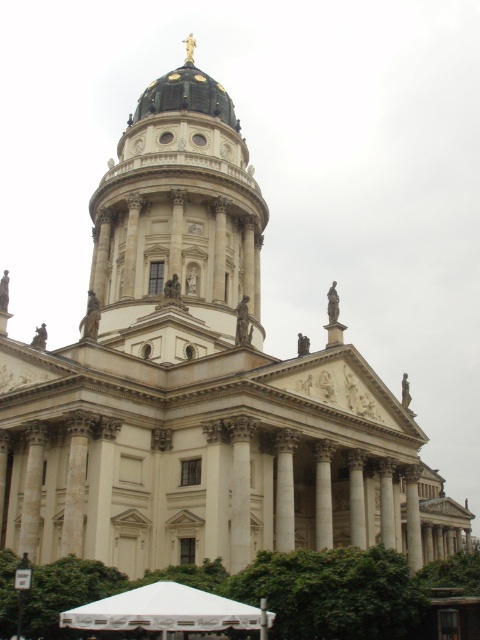
You are standing in front of the grand neoclassical building described. You want to take a photo that captures the entire black dome at center without any distortion. Considering the camera you have can focus clearly up to 50 meters, will you be able to take this photo clearly?

The black dome at center is 55.15 meters away from the viewer. Since your camera can focus clearly up to 50 meters, you will not be able to capture the black dome at center clearly without distortion.

You are standing in front of the grand neoclassical building and want to determine the relative positions of two points marked on the facade. The first point is at coordinates point (240, 323) and the second is at point (96, 611). Which of these points is closer to your viewpoint?

Point (240, 323) is further to the viewer than point (96, 611), so the point at (96, 611) is closer to your viewpoint.

You are an architect assessing the proportions of the building. Given the black dome at center and the white fabric canopy at lower center, which one has a greater width?

The black dome at center has a greater width than the white fabric canopy at lower center according to the description.